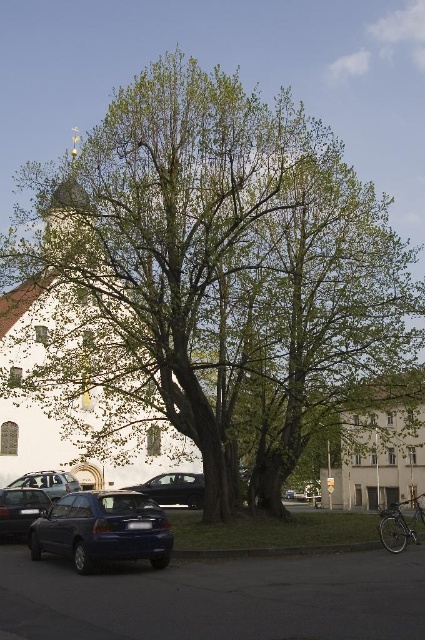
Does white stone church at center have a greater height compared to white concrete building at center?

No, white stone church at center is not taller than white concrete building at center.

Measure the distance between white stone church at center and camera.

17.68 meters

Locate an element on the screen. The width and height of the screenshot is (425, 640). white stone church at center is located at coordinates (70, 396).

Does matte black car at lower left appear over metallic silver car at lower left?

Yes.

Between matte black car at lower left and metallic silver car at lower left, which one appears on the left side from the viewer's perspective?

Positioned to the left is metallic silver car at lower left.

Identify the location of matte black car at lower left. The image size is (425, 640). (19, 509).

Does white concrete building at center have a greater width compared to blue metallic car at center?

Yes, white concrete building at center is wider than blue metallic car at center.

Can you confirm if white concrete building at center is smaller than blue metallic car at center?

No, white concrete building at center is not smaller than blue metallic car at center.

The image size is (425, 640). In order to click on white concrete building at center in this screenshot , I will do `click(379, 445)`.